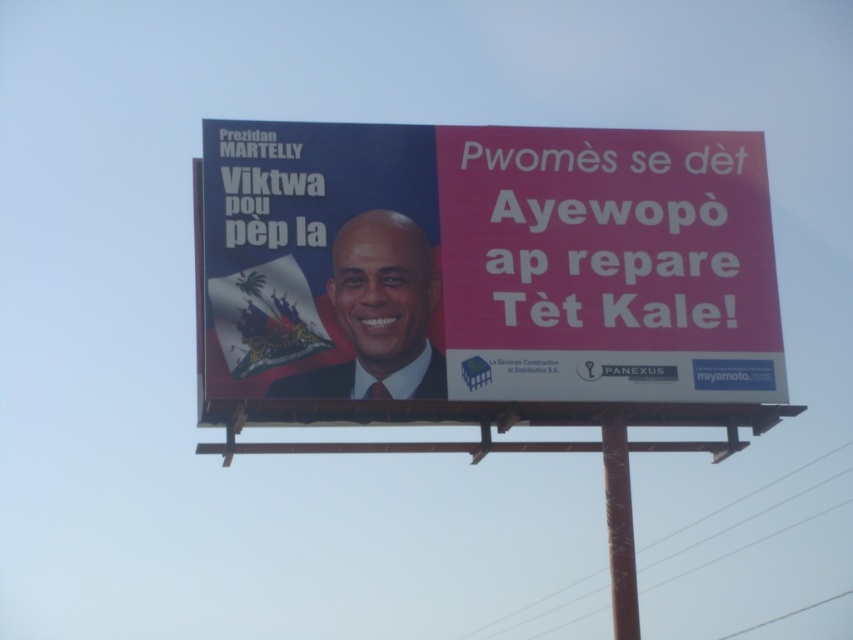
Question: Is matte plastic billboard at center positioned at the back of smooth skin portrait at center?

Choices:
 (A) no
 (B) yes

Answer: (A)

Question: Is matte plastic billboard at center behind smooth skin portrait at center?

Choices:
 (A) no
 (B) yes

Answer: (A)

Question: Which is nearer to the metallic pole at center?

Choices:
 (A) matte plastic billboard at center
 (B) smooth skin portrait at center

Answer: (A)

Question: Which point is farther to the camera?

Choices:
 (A) (428, 285)
 (B) (625, 600)

Answer: (B)

Question: Is matte plastic billboard at center above smooth skin portrait at center?

Choices:
 (A) no
 (B) yes

Answer: (B)

Question: Among these points, which one is nearest to the camera?

Choices:
 (A) (625, 552)
 (B) (380, 237)

Answer: (B)